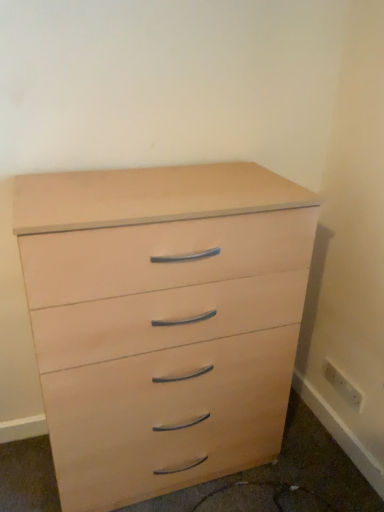
Locate an element on the screen. free location above light wood/veneer chest of drawers at center (from a real-world perspective) is located at coordinates (153, 186).